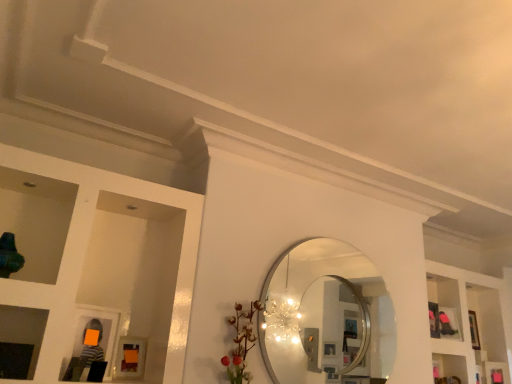
Question: From the image's perspective, relative to silver metallic mirror at center, is white glossy shelves at upper right above or below?

Choices:
 (A) below
 (B) above

Answer: (A)

Question: Based on their positions, is white glossy shelves at upper right located to the left or right of silver metallic mirror at center?

Choices:
 (A) left
 (B) right

Answer: (B)

Question: Based on their relative distances, which object is nearer to the silver metallic mirror at center?

Choices:
 (A) matte orange picture frame at lower left
 (B) white glossy shelves at upper right

Answer: (A)

Question: Considering the real-world distances, which object is closest to the matte orange picture frame at lower left?

Choices:
 (A) silver metallic mirror at center
 (B) white glossy shelves at upper right

Answer: (A)